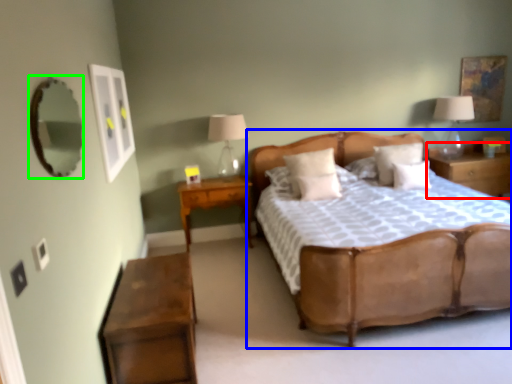
Question: Based on their relative distances, which object is nearer to nightstand (highlighted by a red box)? Choose from bed (highlighted by a blue box) and mirror (highlighted by a green box).

Choices:
 (A) bed
 (B) mirror

Answer: (A)